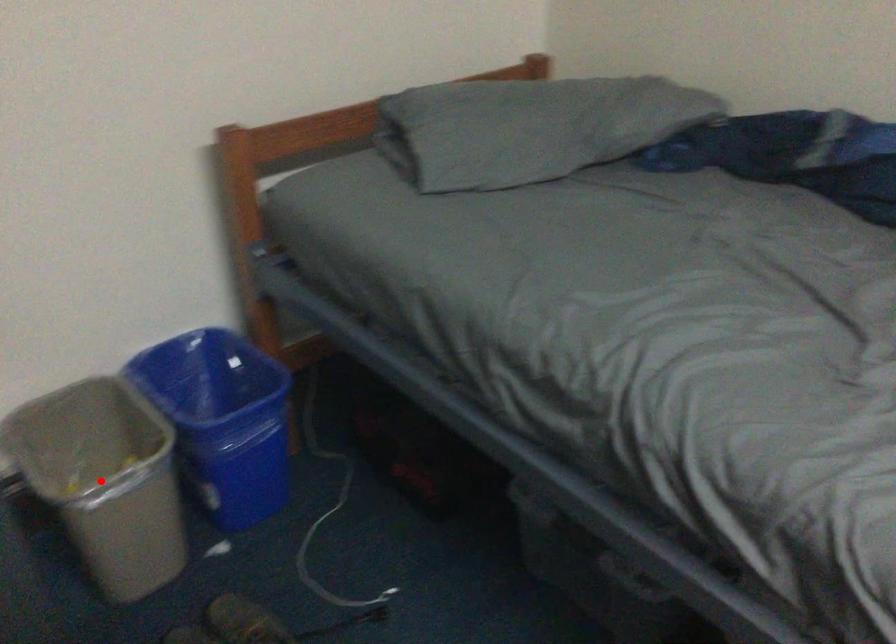
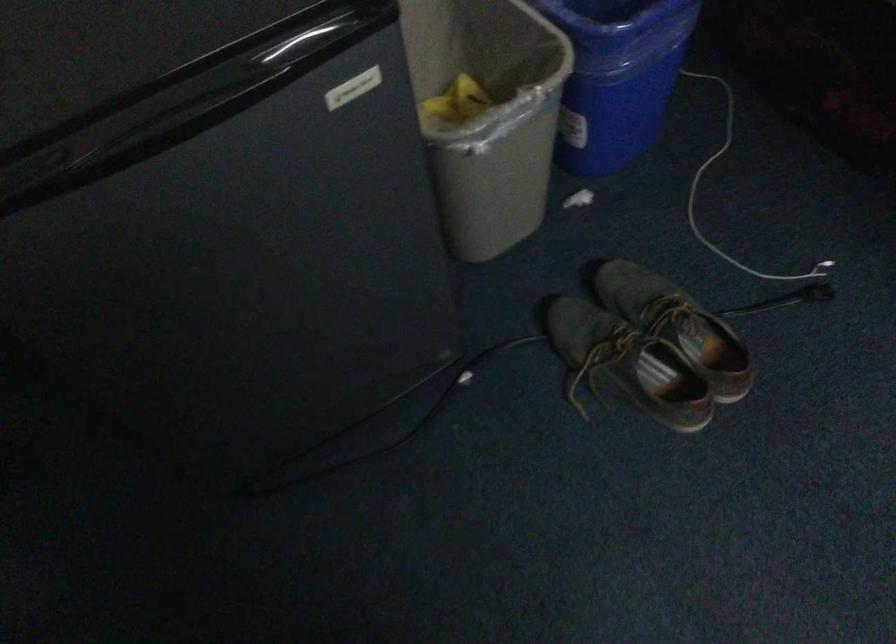
In the second image, find the point that corresponds to the highlighted location in the first image.

(487, 115)